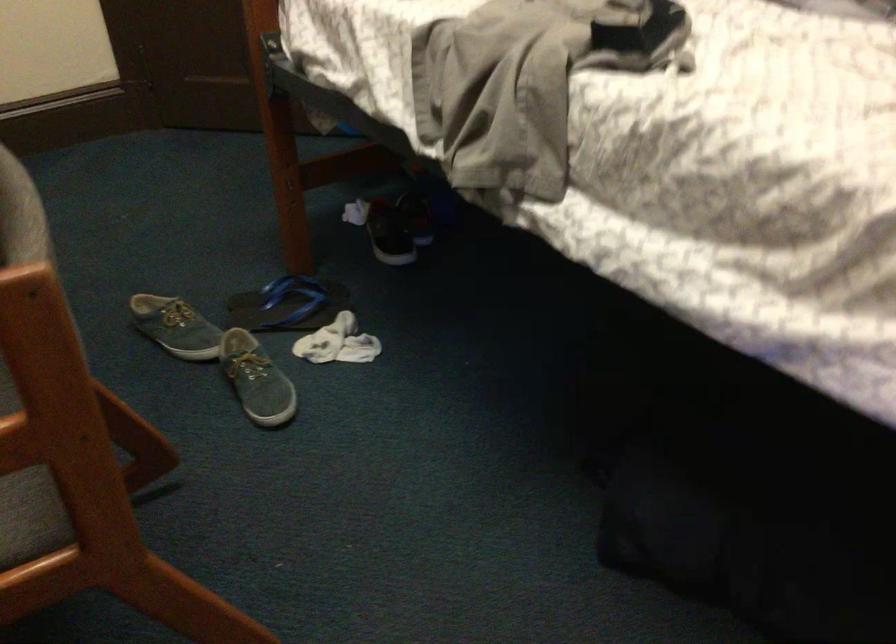
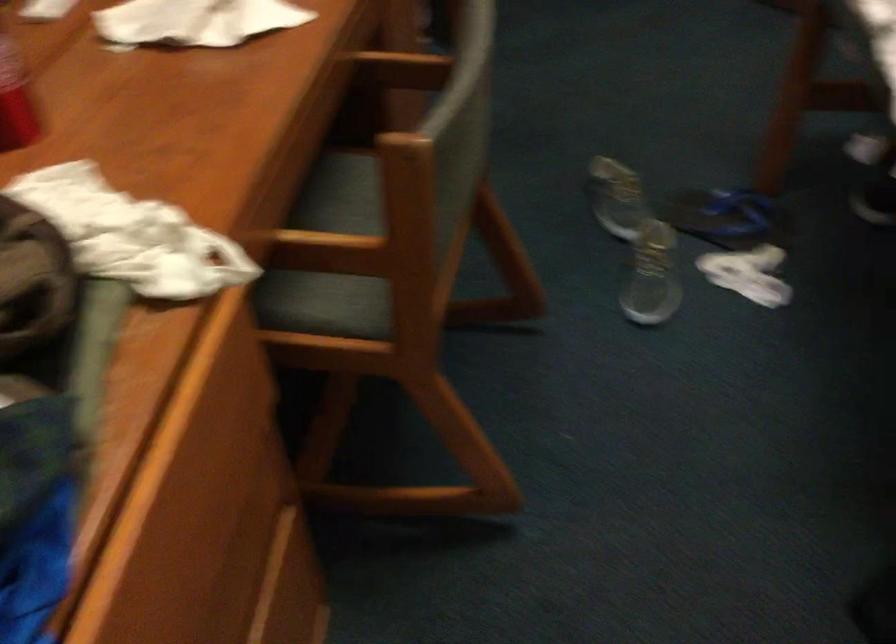
In the second image, find the point that corresponds to pixel 264 390 in the first image.

(650, 287)